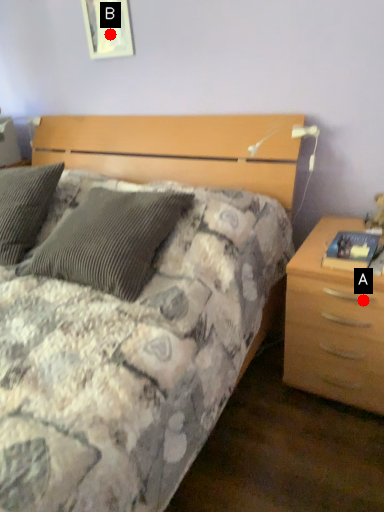
Question: Two points are circled on the image, labeled by A and B beside each circle. Which point is further to the camera?

Choices:
 (A) A is further
 (B) B is further

Answer: (B)